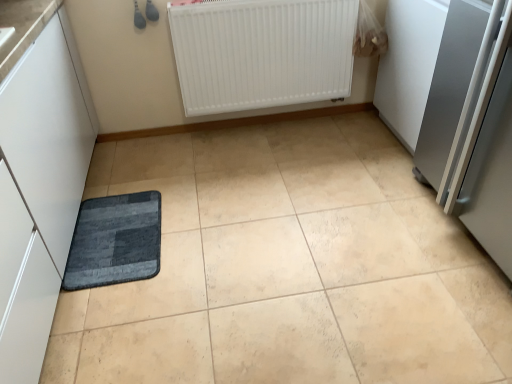
At what (x,y) coordinates should I click in order to perform the action: click on dark gray textured mat at lower left. Please return your answer as a coordinate pair (x, y). This screenshot has width=512, height=384. Looking at the image, I should click on (115, 241).

Where is `white matte radiator at upper center`? This screenshot has height=384, width=512. white matte radiator at upper center is located at coordinates (262, 52).

At what (x,y) coordinates should I click in order to perform the action: click on dark gray textured mat at lower left. Please return your answer as a coordinate pair (x, y). Looking at the image, I should click on pyautogui.click(x=115, y=241).

Based on the photo, is dark gray textured mat at lower left taller or shorter than satin silver refrigerator at right?

dark gray textured mat at lower left is shorter than satin silver refrigerator at right.

Considering the relative sizes of dark gray textured mat at lower left and satin silver refrigerator at right in the image provided, is dark gray textured mat at lower left bigger than satin silver refrigerator at right?

No.

From a real-world perspective, which object stands above the other?

satin silver refrigerator at right.

Identify the location of mat that is on the left side of white matte radiator at upper center. This screenshot has width=512, height=384. (115, 241).

Is dark gray textured mat at lower left directly adjacent to white matte radiator at upper center?

No, dark gray textured mat at lower left is not touching white matte radiator at upper center.

Is dark gray textured mat at lower left thinner than white matte radiator at upper center?

Incorrect, the width of dark gray textured mat at lower left is not less than that of white matte radiator at upper center.

From a real-world perspective, is dark gray textured mat at lower left over white matte radiator at upper center?

No, from a real-world perspective, dark gray textured mat at lower left is not over white matte radiator at upper center

Based on the photo, which is farther from the camera, (326, 67) or (135, 210)?

The point (326, 67) is more distant.

Does white matte radiator at upper center turn towards dark gray textured mat at lower left?

Yes, white matte radiator at upper center is facing dark gray textured mat at lower left.

Can you confirm if white matte radiator at upper center is positioned to the right of dark gray textured mat at lower left?

Yes.

Who is more distant, satin silver refrigerator at right or white matte radiator at upper center?

Positioned behind is white matte radiator at upper center.

Which of these two, satin silver refrigerator at right or white matte radiator at upper center, is wider?

satin silver refrigerator at right is wider.

Between satin silver refrigerator at right and white matte radiator at upper center, which one has less height?

white matte radiator at upper center.

Is satin silver refrigerator at right to the left or to the right of white matte radiator at upper center in the image?

Based on their positions, satin silver refrigerator at right is located to the right of white matte radiator at upper center.

Are white matte radiator at upper center and satin silver refrigerator at right beside each other?

No, white matte radiator at upper center is not making contact with satin silver refrigerator at right.

From the image's perspective, is white matte radiator at upper center positioned above or below satin silver refrigerator at right?

Based on their image positions, white matte radiator at upper center is located above satin silver refrigerator at right.

Locate an element on the screen. The image size is (512, 384). appliance located in front of the white matte radiator at upper center is located at coordinates (473, 125).

In terms of width, does white matte radiator at upper center look wider or thinner when compared to satin silver refrigerator at right?

In the image, white matte radiator at upper center appears to be more narrow than satin silver refrigerator at right.

Does satin silver refrigerator at right have a greater height compared to dark gray textured mat at lower left?

Indeed, satin silver refrigerator at right has a greater height compared to dark gray textured mat at lower left.

Are satin silver refrigerator at right and dark gray textured mat at lower left located far from each other?

Yes.

Considering the relative positions of satin silver refrigerator at right and dark gray textured mat at lower left in the image provided, is satin silver refrigerator at right to the right of dark gray textured mat at lower left from the viewer's perspective?

Indeed, satin silver refrigerator at right is positioned on the right side of dark gray textured mat at lower left.

Can you confirm if satin silver refrigerator at right is thinner than dark gray textured mat at lower left?

In fact, satin silver refrigerator at right might be wider than dark gray textured mat at lower left.

Where is `appliance above the dark gray textured mat at lower left (from a real-world perspective)`? This screenshot has height=384, width=512. appliance above the dark gray textured mat at lower left (from a real-world perspective) is located at coordinates (473, 125).

This screenshot has width=512, height=384. I want to click on radiator located on the right of dark gray textured mat at lower left, so click(262, 52).

When comparing their distances from satin silver refrigerator at right, does white matte radiator at upper center or dark gray textured mat at lower left seem closer?

white matte radiator at upper center.

Which object lies nearer to the anchor point dark gray textured mat at lower left, satin silver refrigerator at right or white matte radiator at upper center?

The object closer to dark gray textured mat at lower left is white matte radiator at upper center.

Based on their spatial positions, is dark gray textured mat at lower left or white matte radiator at upper center closer to satin silver refrigerator at right?

white matte radiator at upper center is closer to satin silver refrigerator at right.

Based on the photo, which object lies further to the anchor point white matte radiator at upper center, dark gray textured mat at lower left or satin silver refrigerator at right?

The object further to white matte radiator at upper center is dark gray textured mat at lower left.

When comparing their distances from white matte radiator at upper center, does satin silver refrigerator at right or dark gray textured mat at lower left seem further?

Based on the image, dark gray textured mat at lower left appears to be further to white matte radiator at upper center.

Considering their positions, is white matte radiator at upper center positioned further to dark gray textured mat at lower left than satin silver refrigerator at right?

The object further to dark gray textured mat at lower left is satin silver refrigerator at right.

At what (x,y) coordinates should I click in order to perform the action: click on radiator situated between dark gray textured mat at lower left and satin silver refrigerator at right from left to right. Please return your answer as a coordinate pair (x, y). Looking at the image, I should click on (262, 52).